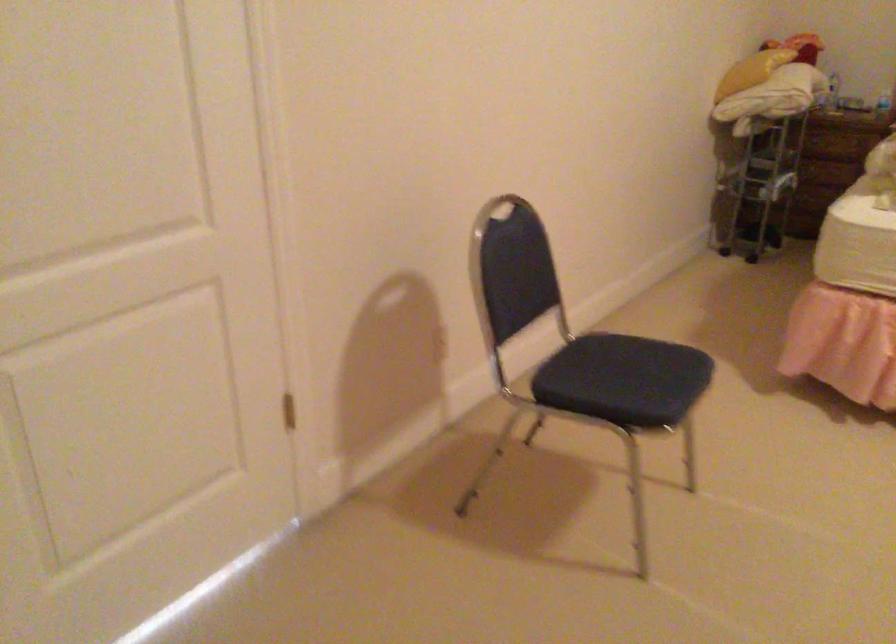
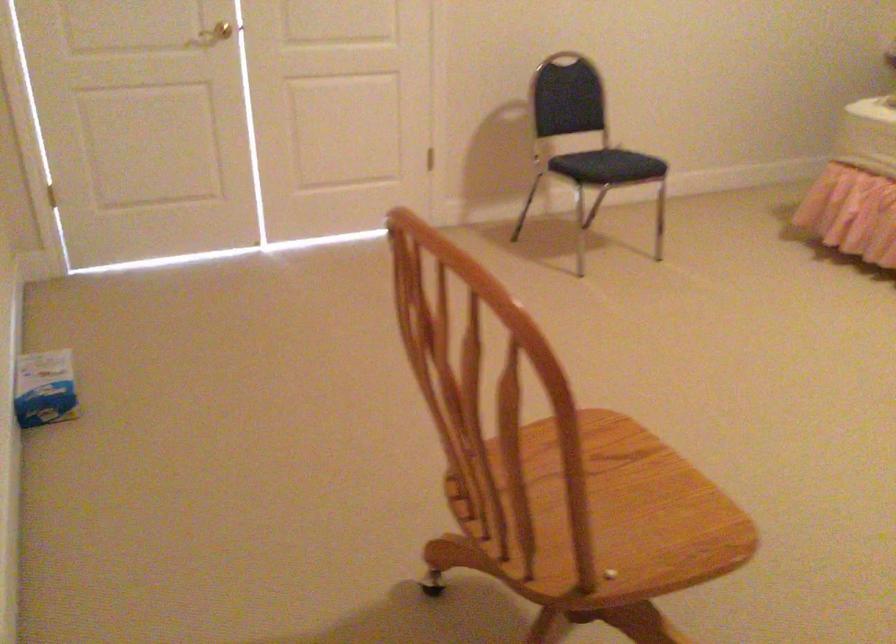
Find the pixel in the second image that matches [624,392] in the first image.

(607, 166)